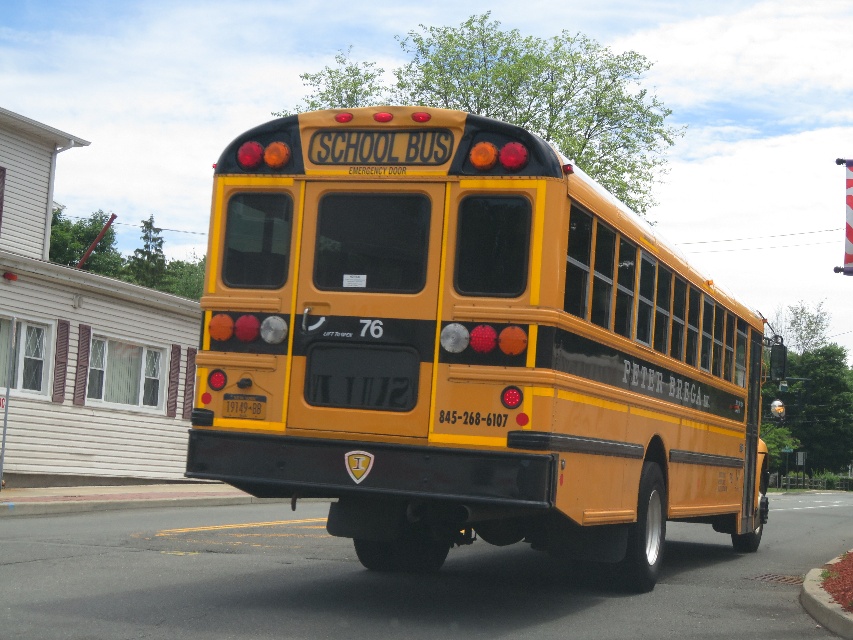
Is yellow matte/solid school bus at center smaller than concrete at lower right?

Correct, yellow matte/solid school bus at center occupies less space than concrete at lower right.

Can you confirm if yellow matte/solid school bus at center is positioned to the left of concrete at lower right?

Indeed, yellow matte/solid school bus at center is positioned on the left side of concrete at lower right.

Is point (477, 504) positioned before point (802, 604)?

Yes, point (477, 504) is in front of point (802, 604).

Locate an element on the screen. The height and width of the screenshot is (640, 853). yellow matte/solid school bus at center is located at coordinates (467, 348).

Does point (815, 579) come behind point (224, 396)?

Yes, point (815, 579) is farther from viewer.

Does concrete at lower right have a lesser height compared to yellow matte license plate at center?

In fact, concrete at lower right may be taller than yellow matte license plate at center.

Who is more forward, (817, 620) or (221, 412)?

Positioned in front is point (221, 412).

At what (x,y) coordinates should I click in order to perform the action: click on concrete at lower right. Please return your answer as a coordinate pair (x, y). The height and width of the screenshot is (640, 853). Looking at the image, I should click on (824, 605).

Does yellow matte/solid school bus at center have a greater height compared to yellow matte license plate at center?

Yes.

Does yellow matte/solid school bus at center appear under yellow matte license plate at center?

No, yellow matte/solid school bus at center is not below yellow matte license plate at center.

This screenshot has width=853, height=640. Identify the location of yellow matte/solid school bus at center. (467, 348).

Locate an element on the screen. yellow matte/solid school bus at center is located at coordinates (467, 348).